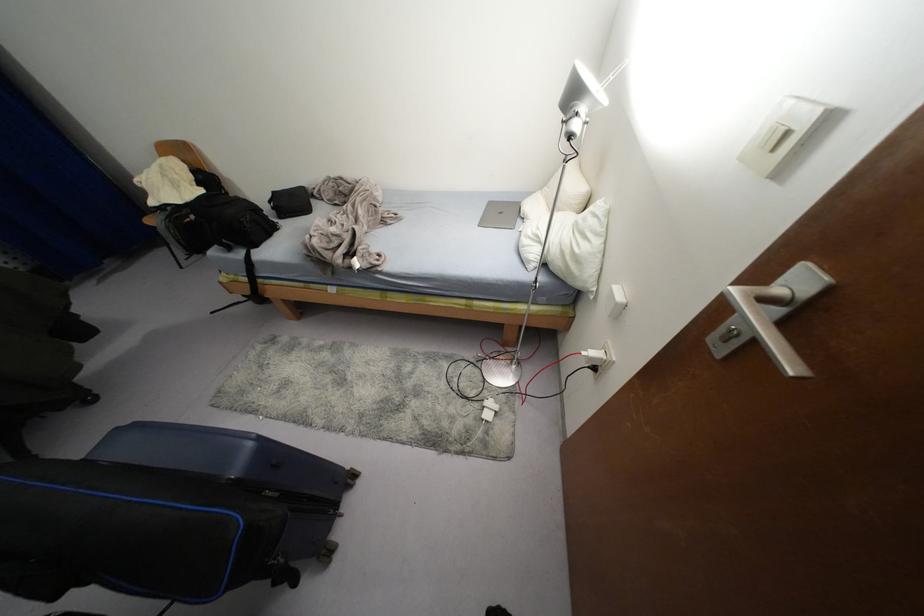
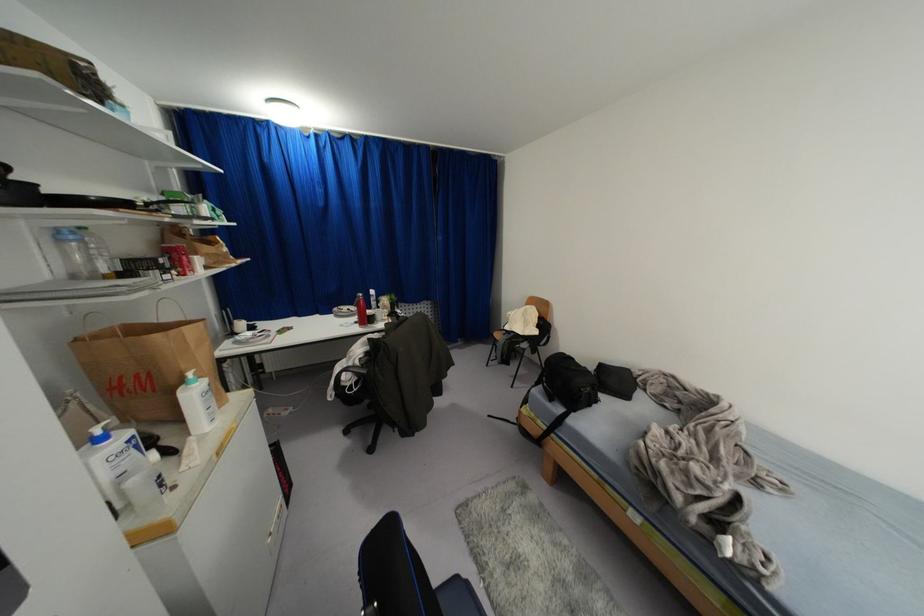
Question: The camera is either moving clockwise (left) or counter-clockwise (right) around the object. The first image is from the beginning of the video and the second image is from the end. Is the camera moving left or right when shooting the video?

Choices:
 (A) Left
 (B) Right

Answer: (B)